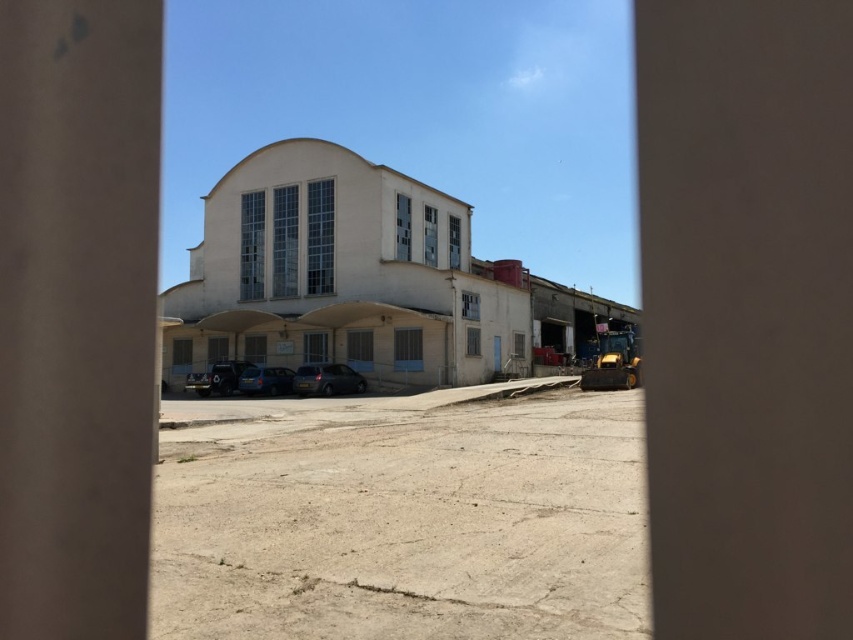
Consider the image. You are a delivery driver who needs to park your truck between the shiny black car at center and the matte blue van at center. Is there enough space between them for your truck which is 2 meters wide?

The shiny black car at center is positioned on the left side of matte blue van at center, but the exact distance between them isn t specified. Without knowing the gap width, it s impossible to determine if it s sufficient for a 2 meter wide truck. You should check the space physically before attempting to park.

You are a delivery driver needing to park your truck between the satin black car at center and the matte blue van at center. Is there enough space between them for your truck, which is 6 meters long?

The satin black car at center is in front of the matte blue van at center, so there is no space between them for your truck to park.

You are a delivery driver who needs to park your matte blue van at center near the smooth concrete pillar at center. Based on the scene, can your van fit next to the pillar without touching it?

The smooth concrete pillar at center is larger in size than the matte blue van at center, so there might not be enough space for the matte blue van at center to park next to the pillar without touching it.